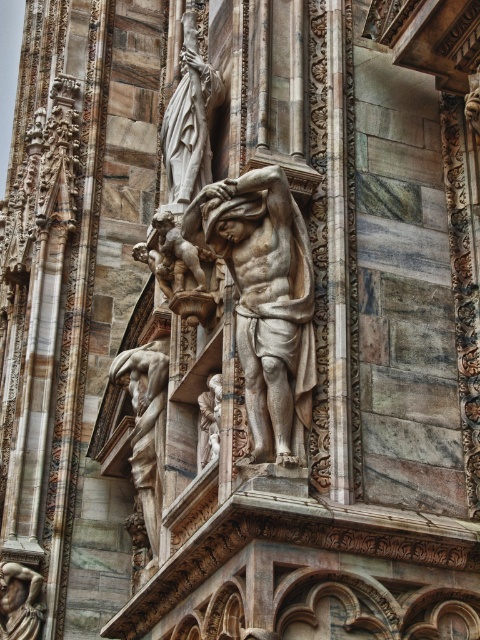
Can you confirm if marble statue at center is taller than polished stone statue at center?

Indeed, marble statue at center has a greater height compared to polished stone statue at center.

In the scene shown: Who is more forward, [250,253] or [153,433]?

Point [250,253]

I want to click on marble statue at center, so click(x=264, y=300).

Does point (299, 417) come closer to viewer compared to point (199, 42)?

Yes, point (299, 417) is closer to viewer.

In the scene shown: Between marble statue at center and white marble statue at upper left, which one is positioned higher?

Positioned higher is white marble statue at upper left.

Between point (233, 246) and point (190, 182), which one is positioned in front?

Point (233, 246) is in front.

Identify the location of marble statue at center. (264, 300).

Does polished marble cherub at center appear over polished bronze statue at lower left?

Yes, polished marble cherub at center is above polished bronze statue at lower left.

In the scene shown: Who is lower down, polished marble cherub at center or polished bronze statue at lower left?

polished bronze statue at lower left

At what (x,y) coordinates should I click in order to perform the action: click on polished marble cherub at center. Please return your answer as a coordinate pair (x, y). Looking at the image, I should click on (171, 257).